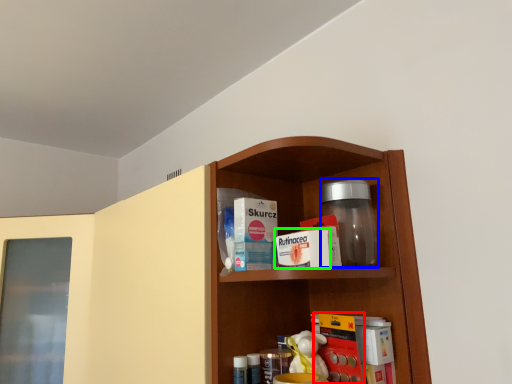
Question: Considering the real-world distances, which object is farthest from book (highlighted by a red box)? glass jar (highlighted by a blue box) or product (highlighted by a green box)?

Choices:
 (A) glass jar
 (B) product

Answer: (B)